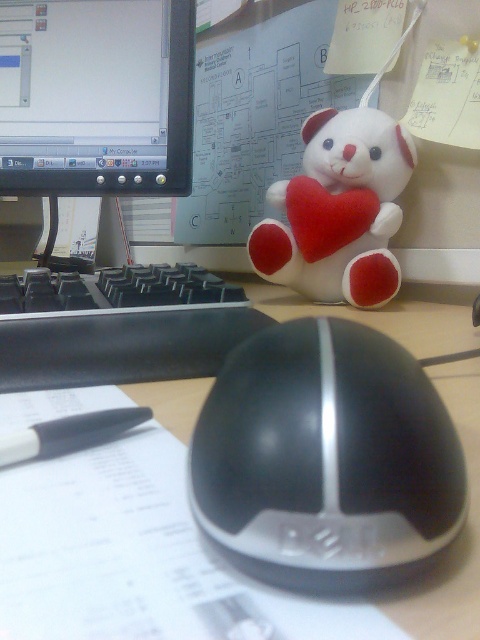
Can you confirm if matte plastic monitor at upper left is positioned above black plastic keyboard at left?

Indeed, matte plastic monitor at upper left is positioned over black plastic keyboard at left.

How much distance is there between matte plastic monitor at upper left and black plastic keyboard at left?

matte plastic monitor at upper left and black plastic keyboard at left are 11.75 inches apart from each other.

Between point (13, 164) and point (208, 371), which one is positioned behind?

The point (13, 164) is behind.

Where is `matte plastic monitor at upper left`? This screenshot has height=640, width=480. matte plastic monitor at upper left is located at coordinates (96, 97).

Which is behind, point (342, 433) or point (137, 16)?

Positioned behind is point (137, 16).

Is black glossy mouse at center to the left of matte plastic monitor at upper left from the viewer's perspective?

No, black glossy mouse at center is not to the left of matte plastic monitor at upper left.

Is point (358, 570) behind point (72, 145)?

No, (358, 570) is in front of (72, 145).

Where is `black glossy mouse at center`? black glossy mouse at center is located at coordinates (325, 458).

Can you confirm if black plastic keyboard at left is positioned above black plastic mouse at center?

Correct, black plastic keyboard at left is located above black plastic mouse at center.

How much distance is there between black plastic keyboard at left and black plastic mouse at center?

black plastic keyboard at left is 5.58 inches from black plastic mouse at center.

Between point (90, 330) and point (441, 320), which one is positioned behind?

Point (441, 320)

The height and width of the screenshot is (640, 480). I want to click on black plastic keyboard at left, so click(120, 326).